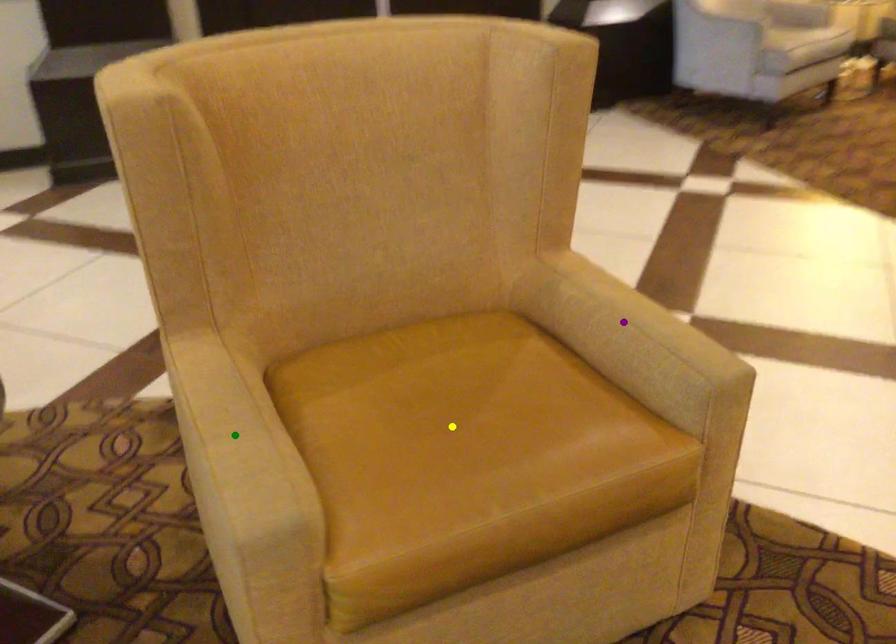
Order these from nearest to farthest:
green point
purple point
yellow point

green point
yellow point
purple point